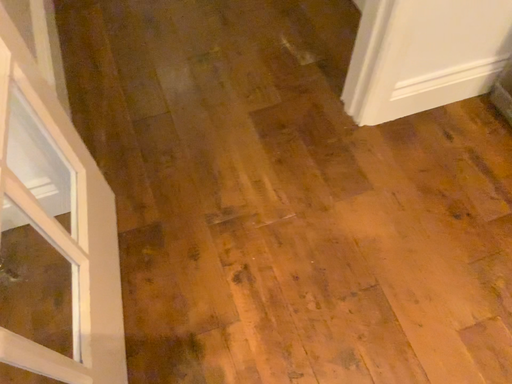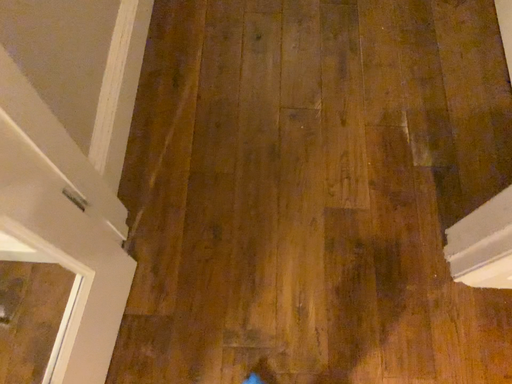
Question: How did the camera likely rotate when shooting the video?

Choices:
 (A) rotated right
 (B) rotated left

Answer: (B)